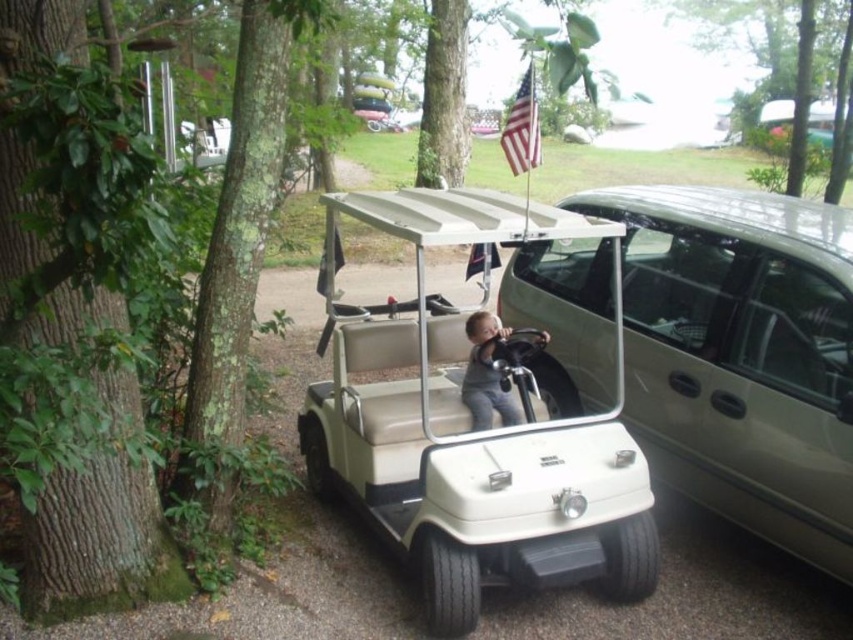
Looking at this image, who is lower down, matte gray minivan at center or gray matte shirt at center?

Positioned lower is gray matte shirt at center.

Can you confirm if matte gray minivan at center is positioned below gray matte shirt at center?

No.

Is point (653, 433) positioned after point (480, 412)?

Yes, point (653, 433) is farther from viewer.

Find the location of a particular element. matte gray minivan at center is located at coordinates tap(741, 355).

Who is taller, matte gray minivan at center or beige leather golf cart at center?

With more height is beige leather golf cart at center.

What do you see at coordinates (741, 355) in the screenshot? I see `matte gray minivan at center` at bounding box center [741, 355].

Between point (722, 413) and point (343, 419), which one is positioned behind?

Positioned behind is point (343, 419).

You are a GUI agent. You are given a task and a screenshot of the screen. Output one action in this format:
    pyautogui.click(x=<x>, y=<y>)
    Task: Click on the matte gray minivan at center
    This screenshot has height=640, width=853.
    Given the screenshot: What is the action you would take?
    pyautogui.click(x=741, y=355)

Find the location of a particular element. matte gray minivan at center is located at coordinates (741, 355).

Is matte gray minivan at center behind american flag at upper center?

Yes, it is.

What do you see at coordinates (741, 355) in the screenshot? This screenshot has height=640, width=853. I see `matte gray minivan at center` at bounding box center [741, 355].

Locate an element on the screen. matte gray minivan at center is located at coordinates (741, 355).